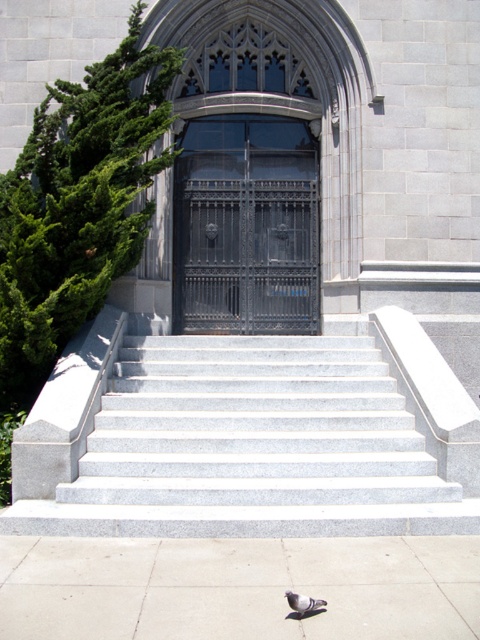
Can you confirm if black wrought iron door at center is wider than gray matte pigeon at lower center?

Yes, black wrought iron door at center is wider than gray matte pigeon at lower center.

Does black wrought iron door at center appear over gray matte pigeon at lower center?

Yes.

The height and width of the screenshot is (640, 480). What are the coordinates of `black wrought iron door at center` in the screenshot? It's located at pos(245,227).

Can you confirm if gray granite stairs at center is smaller than black wrought iron door at center?

No.

What do you see at coordinates (251, 445) in the screenshot? I see `gray granite stairs at center` at bounding box center [251, 445].

Is point (262, 412) more distant than point (180, 262)?

No, it is not.

Where is `gray granite stairs at center`? This screenshot has width=480, height=640. gray granite stairs at center is located at coordinates (251, 445).

Who is shorter, gray granite stairs at center or gray matte pigeon at lower center?

Standing shorter between the two is gray matte pigeon at lower center.

Is gray granite stairs at center bigger than gray matte pigeon at lower center?

Correct, gray granite stairs at center is larger in size than gray matte pigeon at lower center.

Describe the element at coordinates (251, 445) in the screenshot. The height and width of the screenshot is (640, 480). I see `gray granite stairs at center` at that location.

Locate an element on the screen. gray granite stairs at center is located at coordinates (251, 445).